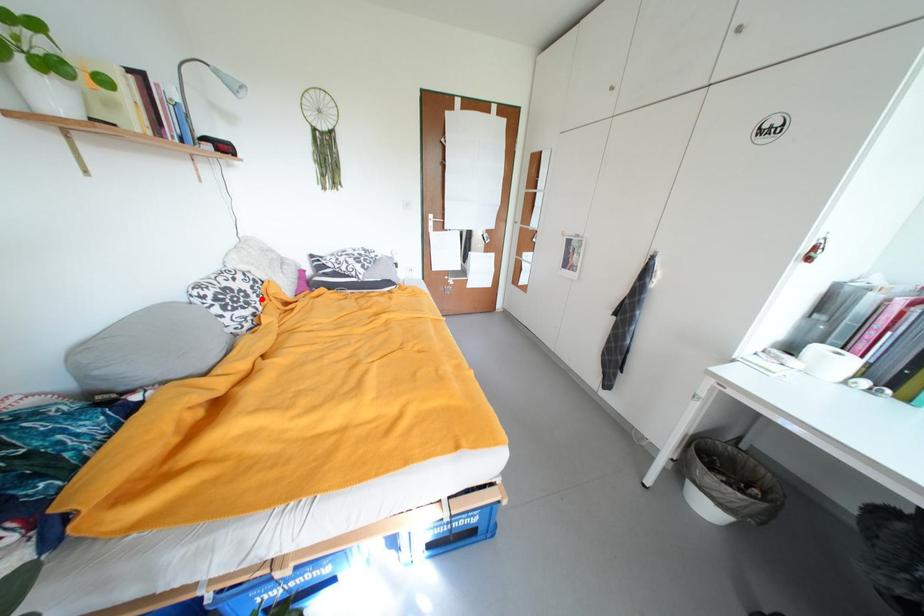
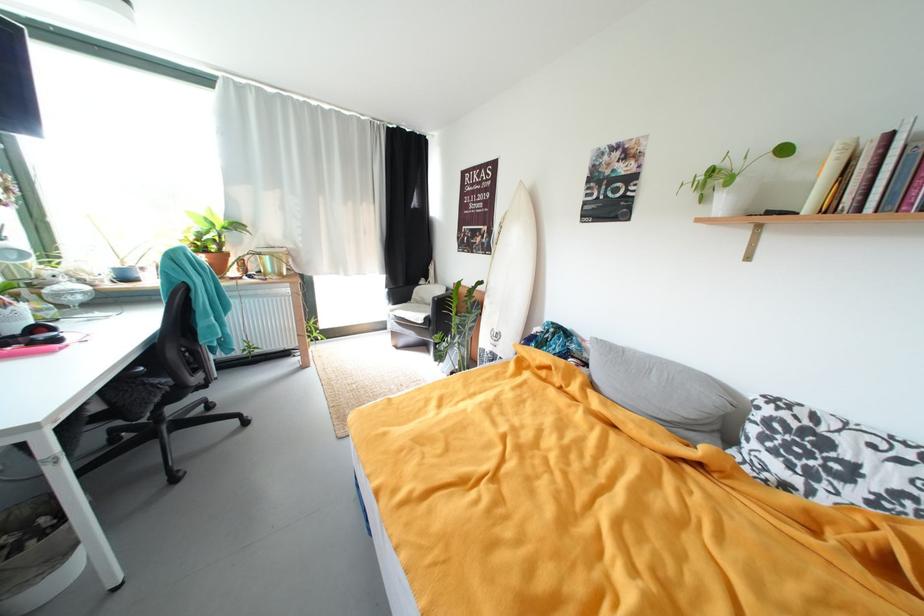
Question: I am providing you with two images of the same scene from different viewpoints. A red point is shown in image1. For the corresponding object point in image2, is it positioned nearer or farther from the camera?

Choices:
 (A) Nearer
 (B) Farther

Answer: (B)